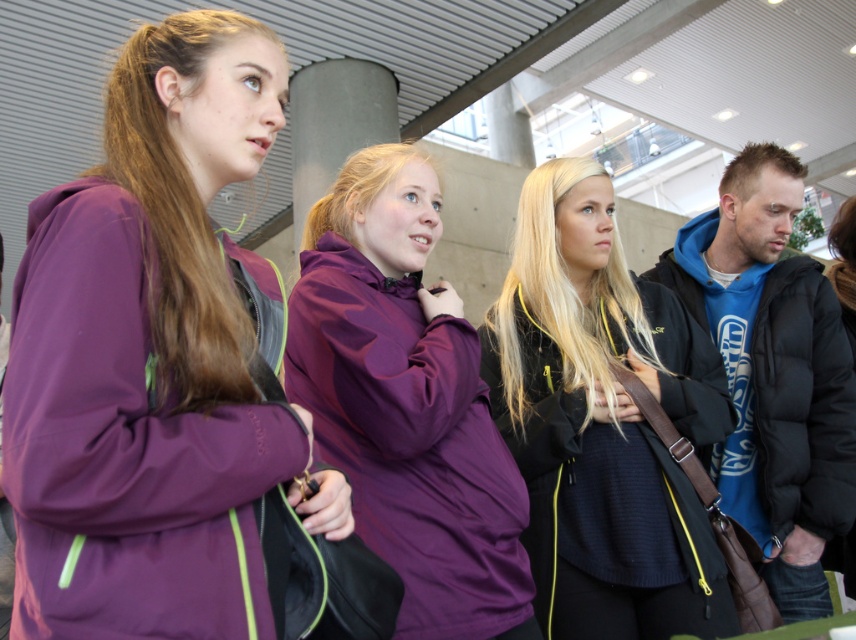
Question: Which point is farther to the camera?

Choices:
 (A) blue fleece jacket at right
 (B) purple softshell jacket at left

Answer: (A)

Question: Does purple softshell jacket at left come behind black knit sweater at center?

Choices:
 (A) yes
 (B) no

Answer: (B)

Question: Is purple softshell jacket at left to the left of black knit sweater at center from the viewer's perspective?

Choices:
 (A) no
 (B) yes

Answer: (B)

Question: Can you confirm if black knit sweater at center is positioned to the left of blue fleece jacket at right?

Choices:
 (A) yes
 (B) no

Answer: (A)

Question: Among these points, which one is nearest to the camera?

Choices:
 (A) (783, 536)
 (B) (307, 221)
 (C) (212, 355)
 (D) (704, 406)

Answer: (C)

Question: Which object is the closest to the purple softshell jacket at left?

Choices:
 (A) black knit sweater at center
 (B) blue fleece jacket at right
 (C) purple matte jacket at center

Answer: (C)